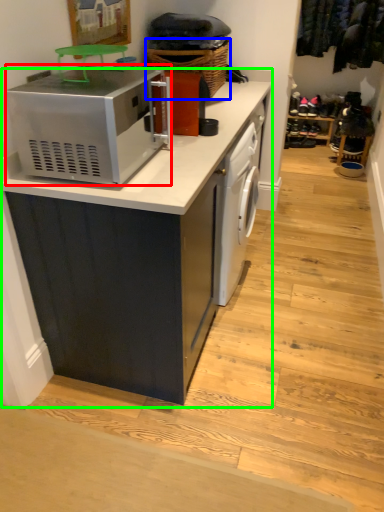
Question: Which object is the farthest from home appliance (highlighted by a red box)? Choose among these: basket (highlighted by a blue box) or cabinetry (highlighted by a green box).

Choices:
 (A) basket
 (B) cabinetry

Answer: (A)